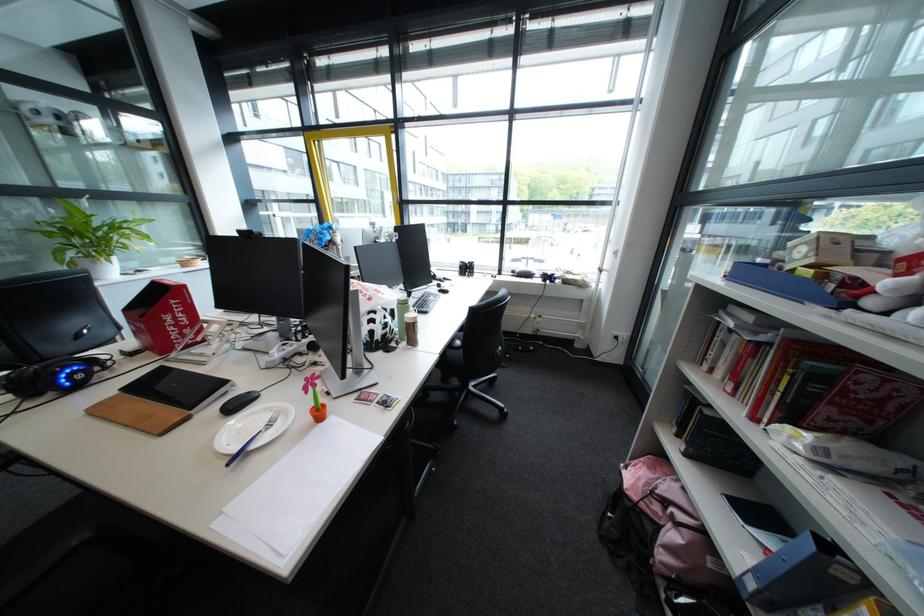
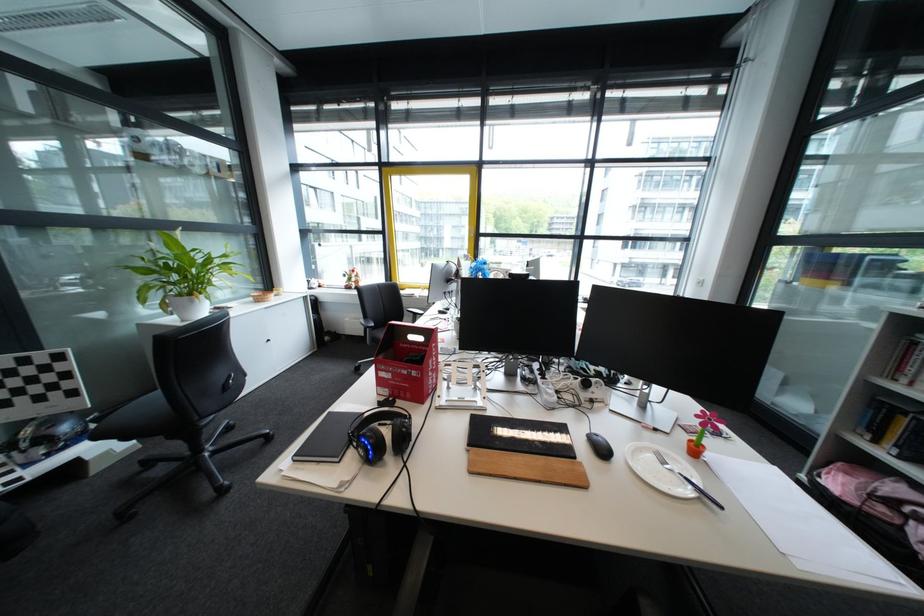
Where in the second image is the point corresponding to point 502,225 from the first image?

(472, 251)